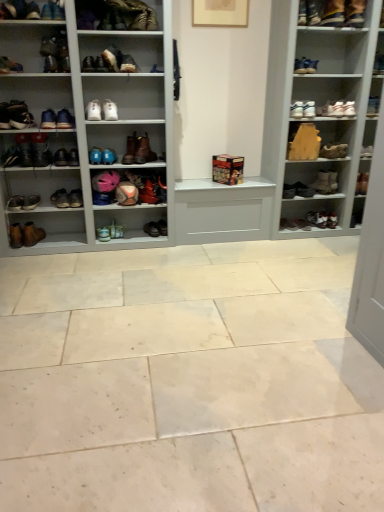
Question: Does brown leather boot at left, which is counted as the fourth shoe, starting from the left, appear on the right side of brown leather shoe at lower left, the 23th shoe positioned from the right?

Choices:
 (A) no
 (B) yes

Answer: (A)

Question: Is brown leather shoe at lower left, the 6th shoe from the left, completely or partially inside brown leather boot at left, marked as the 25th shoe in a right-to-left arrangement?

Choices:
 (A) no
 (B) yes

Answer: (A)

Question: Does brown leather boot at left, which is counted as the fourth shoe, starting from the left, have a lesser height compared to brown leather shoe at lower left, the 23th shoe positioned from the right?

Choices:
 (A) no
 (B) yes

Answer: (A)

Question: Considering the relative positions of brown leather boot at left, marked as the 25th shoe in a right-to-left arrangement, and brown leather shoe at lower left, the 23th shoe positioned from the right, in the image provided, is brown leather boot at left, marked as the 25th shoe in a right-to-left arrangement, to the left of brown leather shoe at lower left, the 23th shoe positioned from the right, from the viewer's perspective?

Choices:
 (A) no
 (B) yes

Answer: (B)

Question: Is brown leather boot at left, marked as the 25th shoe in a right-to-left arrangement, oriented away from brown leather shoe at lower left, the 23th shoe positioned from the right?

Choices:
 (A) yes
 (B) no

Answer: (B)

Question: Considering their positions, is shiny black shoe at right, the 26th shoe in the left-to-right sequence, located in front of or behind wooden shelf at upper right, which is counted as the 2th shelf, starting from the left?

Choices:
 (A) behind
 (B) front

Answer: (A)

Question: Would you say shiny black shoe at right, placed as the 3th shoe when sorted from right to left, is inside or outside wooden shelf at upper right, which is counted as the 2th shelf, starting from the left?

Choices:
 (A) inside
 (B) outside

Answer: (B)

Question: Considering the relative positions of shiny black shoe at right, placed as the 3th shoe when sorted from right to left, and wooden shelf at upper right, which appears as the 1th shelf when viewed from the right, in the image provided, is shiny black shoe at right, placed as the 3th shoe when sorted from right to left, to the left or to the right of wooden shelf at upper right, which appears as the 1th shelf when viewed from the right,?

Choices:
 (A) right
 (B) left

Answer: (A)

Question: From a real-world perspective, is shiny black shoe at right, placed as the 3th shoe when sorted from right to left, positioned above or below wooden shelf at upper right, which is counted as the 2th shelf, starting from the left?

Choices:
 (A) below
 (B) above

Answer: (A)

Question: Is brown leather boot at lower left, which appears as the 26th shoe when viewed from the right, inside or outside of white leather sneakers at upper right, arranged as the seventh footwear when viewed from the left?

Choices:
 (A) outside
 (B) inside

Answer: (A)

Question: From a real-world perspective, is brown leather boot at lower left, which appears as the 26th shoe when viewed from the right, physically located above or below white leather sneakers at upper right, which appears as the 3th footwear when ordered from the bottom?

Choices:
 (A) above
 (B) below

Answer: (B)

Question: In terms of size, does brown leather boot at lower left, which appears as the 26th shoe when viewed from the right, appear bigger or smaller than white leather sneakers at upper right, arranged as the seventh footwear when viewed from the left?

Choices:
 (A) small
 (B) big

Answer: (B)

Question: Does point (39, 202) appear closer or farther from the camera than point (306, 105)?

Choices:
 (A) closer
 (B) farther

Answer: (B)

Question: From a real-world perspective, is matte brown boot at upper left, arranged as the 4th footwear when viewed from the top, positioned above or below leather boot at upper right, arranged as the 6th shoe when viewed from the right?

Choices:
 (A) above
 (B) below

Answer: (B)

Question: Based on their sizes in the image, would you say matte brown boot at upper left, the sixth footwear from the right, is bigger or smaller than leather boot at upper right, placed as the 23th shoe when sorted from left to right?

Choices:
 (A) small
 (B) big

Answer: (A)